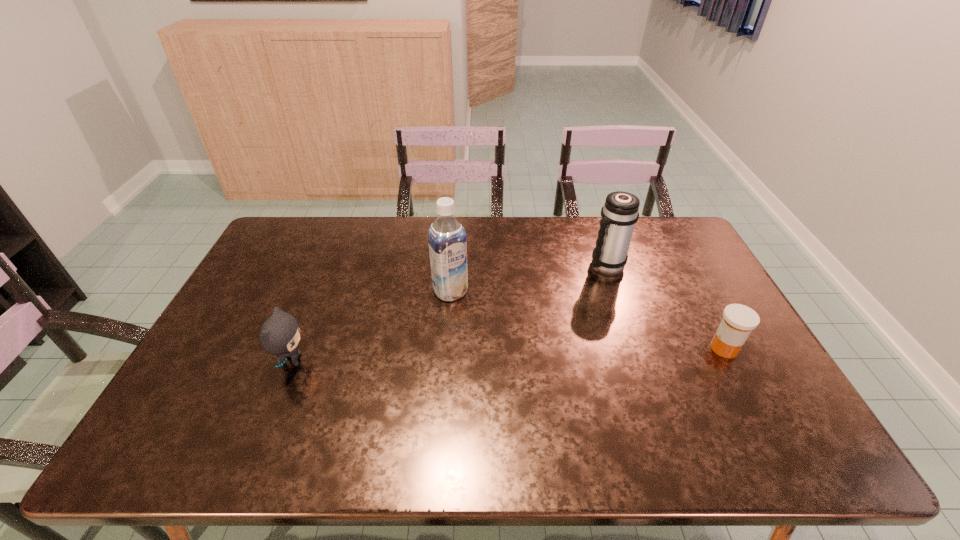
In the image, there is a desktop. At what (x,y) coordinates should I click in order to perform the action: click on vacant area at the near edge. Please return your answer as a coordinate pair (x, y). Looking at the image, I should click on (701, 413).

The height and width of the screenshot is (540, 960). In order to click on blank area at the right edge in this screenshot , I will do `click(714, 382)`.

In the image, there is a desktop. In order to click on vacant space at the far left corner in this screenshot , I will do `click(302, 225)`.

This screenshot has height=540, width=960. Identify the location of blank area at the far right corner. click(661, 218).

Locate an element on the screen. This screenshot has height=540, width=960. unoccupied area between the medicine and the kitten is located at coordinates (508, 355).

The width and height of the screenshot is (960, 540). In order to click on vacant area that lies between the third tallest object and the medicine in this screenshot , I will do `click(508, 355)`.

Identify the location of unoccupied area between the third tallest object and the soya milk. The height and width of the screenshot is (540, 960). (371, 326).

I want to click on free space between the kitten and the third nearest object, so click(x=371, y=326).

Where is `free space between the shortest object and the second object from left to right`? Image resolution: width=960 pixels, height=540 pixels. free space between the shortest object and the second object from left to right is located at coordinates (588, 320).

The image size is (960, 540). In order to click on unoccupied position between the thermos bottle and the medicine in this screenshot , I will do `click(664, 307)`.